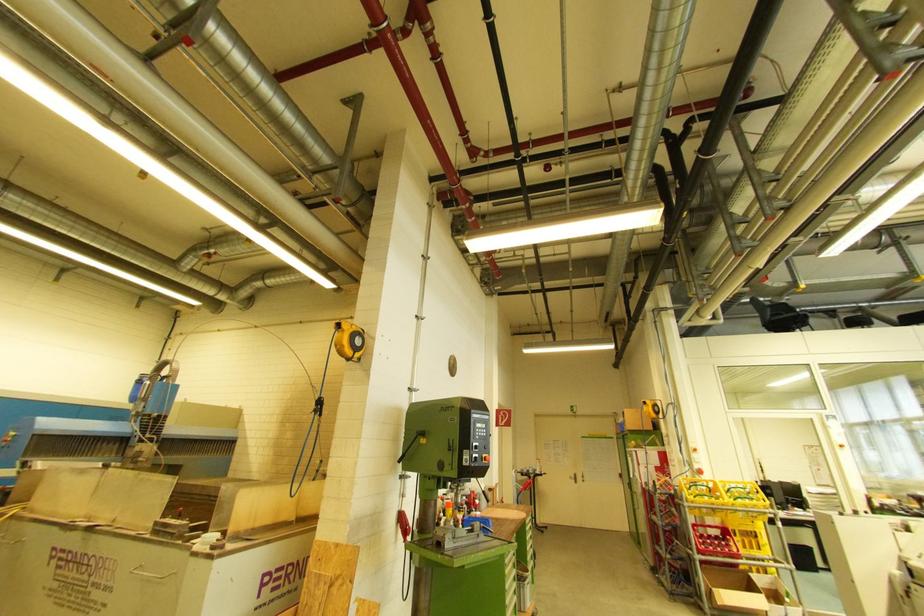
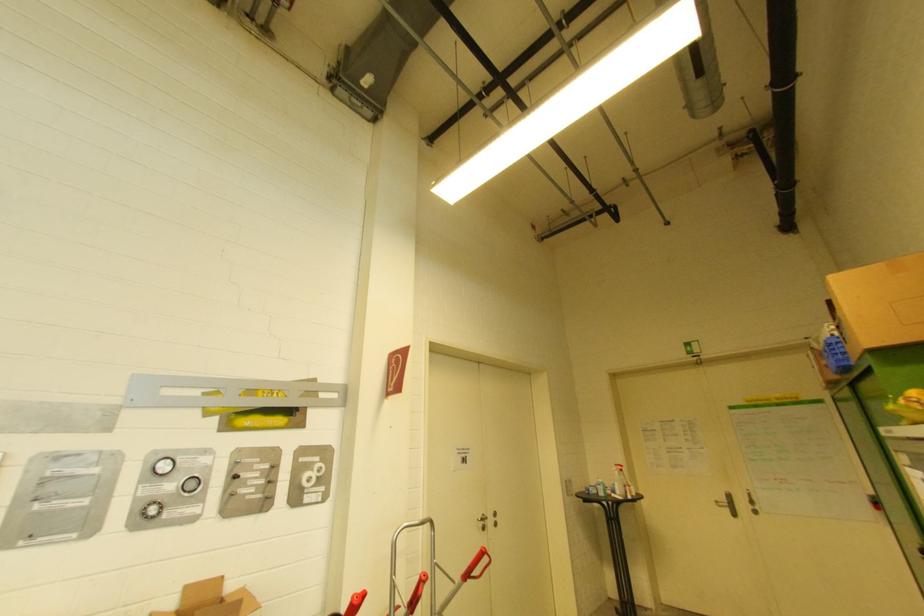
Locate, in the second image, the point that corresponds to (x=625, y=427) in the first image.

(839, 345)